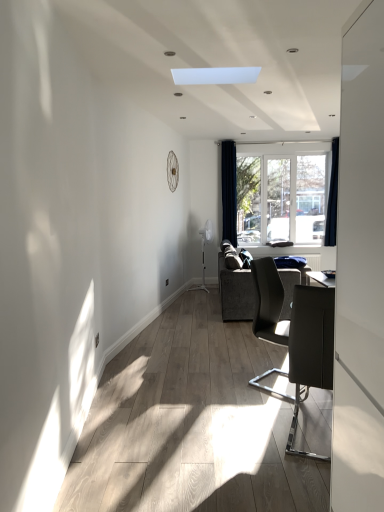
The image size is (384, 512). Find the location of `free space in front of matte black chair at right, which is the second chair from back to front`. free space in front of matte black chair at right, which is the second chair from back to front is located at coordinates (293, 471).